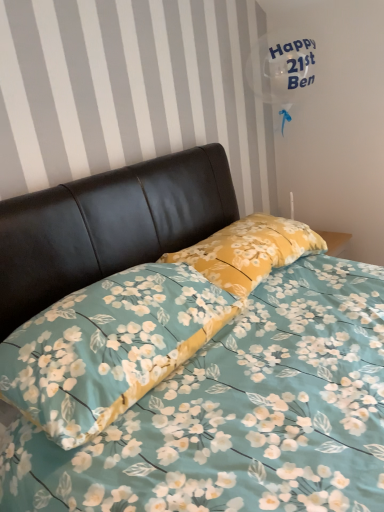
Question: Is yellow floral pillow at center, the 2th pillow from the front, wider or thinner than floral fabric pillow at center, positioned as the second pillow in back-to-front order?

Choices:
 (A) wide
 (B) thin

Answer: (B)

Question: In terms of size, does yellow floral pillow at center, the 2th pillow from the front, appear bigger or smaller than floral fabric pillow at center, positioned as the second pillow in back-to-front order?

Choices:
 (A) small
 (B) big

Answer: (A)

Question: Considering their positions, is yellow floral pillow at center, which appears as the 1th pillow when viewed from the back, located in front of or behind floral fabric pillow at center, arranged as the 1th pillow when viewed from the front?

Choices:
 (A) front
 (B) behind

Answer: (B)

Question: Based on their sizes in the image, would you say floral fabric pillow at center, arranged as the 1th pillow when viewed from the front, is bigger or smaller than yellow floral pillow at center, the 2th pillow from the front?

Choices:
 (A) big
 (B) small

Answer: (A)

Question: Is floral fabric pillow at center, arranged as the 1th pillow when viewed from the front, wider or thinner than yellow floral pillow at center, the 2th pillow from the front?

Choices:
 (A) thin
 (B) wide

Answer: (B)

Question: From a real-world perspective, is floral fabric pillow at center, positioned as the second pillow in back-to-front order, physically located above or below yellow floral pillow at center, which appears as the 1th pillow when viewed from the back?

Choices:
 (A) above
 (B) below

Answer: (B)

Question: From their relative heights in the image, would you say floral fabric pillow at center, positioned as the second pillow in back-to-front order, is taller or shorter than yellow floral pillow at center, the 2th pillow from the front?

Choices:
 (A) tall
 (B) short

Answer: (A)